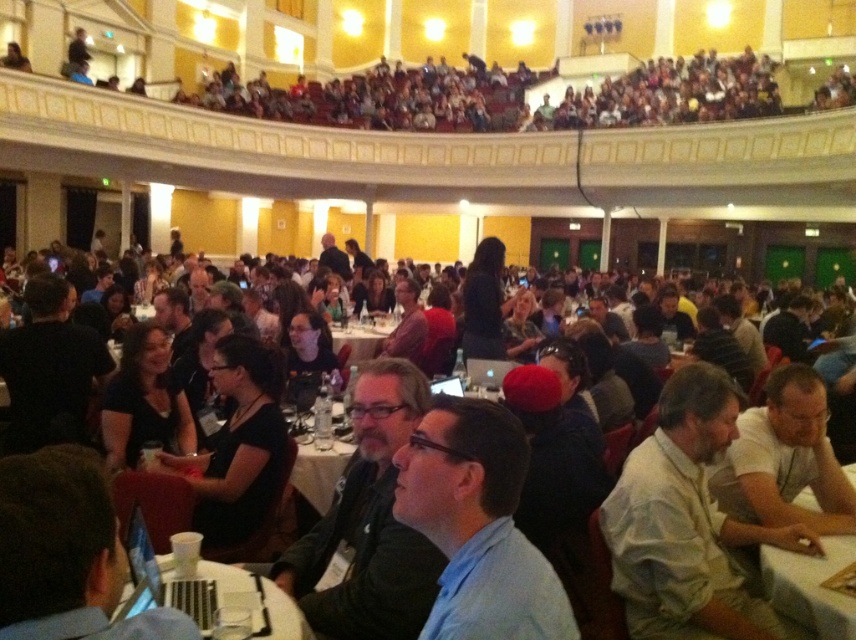
You are standing at the front of the grand hall and want to place a 10 meter long banner from the stage to the white plastic table at lower center. Is the distance sufficient for the banner to reach the table?

The distance from the camera to the white plastic table at lower center is 7.54 meters, so a 10 meter banner would be long enough to reach the table and extend beyond it.

You are a server carrying a tray of drinks and need to move from the entrance to the white plastic table at lower center and then to the white plastic table at center. Considering the distance between them, do you think you can walk directly between them without needing to detour around any obstacles?

The distance between the white plastic table at lower center and the white plastic table at center is 15.50 meters. Since there is no mention of obstacles in the scene description, you can walk directly between them without needing to detour.

In the scene shown: You are a guest at this event and need to place a 12 inch tall decorative item on one of the tables. Which table, the white cloth table at lower right or the white plastic table at center, would be more suitable for placing the item without it being too low or too high compared to the other table?

The white plastic table at center is taller than the white cloth table at lower right. Since the item is 12 inches tall, placing it on the white plastic table at center would ensure it is not too low, while the white cloth table at lower right might make the item appear too tall in comparison.